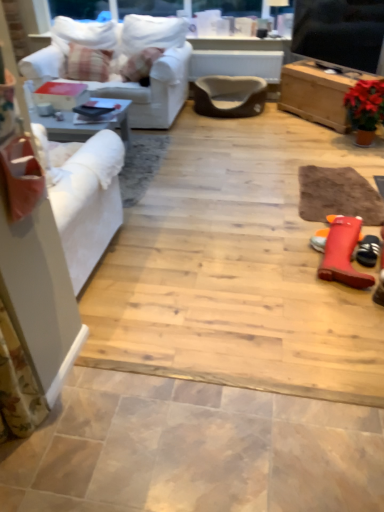
Question: Considering the relative positions of rubber boot at lower right, the 1th footwear when ordered from left to right, and brown fabric pet bed at center, the first table from the left, in the image provided, is rubber boot at lower right, the 1th footwear when ordered from left to right, to the left or to the right of brown fabric pet bed at center, the first table from the left,?

Choices:
 (A) right
 (B) left

Answer: (A)

Question: Is rubber boot at lower right, the 1th footwear when ordered from left to right, bigger or smaller than brown fabric pet bed at center, the first table from the left?

Choices:
 (A) small
 (B) big

Answer: (A)

Question: Which object is positioned farthest from the natural stone tile at lower left, which ranks as the second ceramic tile in bottom-to-top order?

Choices:
 (A) white fabric couch at upper left
 (B) rubber black shoe at lower right, the first footwear viewed from the right
 (C) rubber boot at lower right, the 2th footwear positioned from the right
 (D) brown fabric pet bed at center, the first table from the left
 (E) wooden chest at upper right, which is the first table in right-to-left order

Answer: (D)

Question: Which of these objects is positioned closest to the brown fabric pet bed at center, acting as the second table starting from the right?

Choices:
 (A) rubber black shoe at lower right, marked as the second footwear in a left-to-right arrangement
 (B) black glossy tv at upper right
 (C) matte ceramic tile at lower center, the first ceramic tile when ordered from front to back
 (D) plaid fabric pillow at upper left
 (E) wooden chest at upper right, placed as the 2th table when sorted from left to right

Answer: (E)